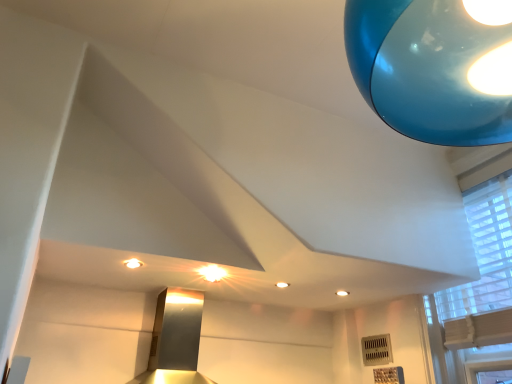
What do you see at coordinates (133, 263) in the screenshot?
I see `matte white light fixture at upper center` at bounding box center [133, 263].

You are a GUI agent. You are given a task and a screenshot of the screen. Output one action in this format:
    pyautogui.click(x=<x>, y=<y>)
    Task: Click on the matte white light fixture at upper center
    
    Given the screenshot: What is the action you would take?
    pyautogui.click(x=133, y=263)

I want to click on white textured window at upper right, so click(480, 290).

This screenshot has height=384, width=512. What do you see at coordinates (480, 290) in the screenshot?
I see `white textured window at upper right` at bounding box center [480, 290].

Identify the location of matte white light fixture at upper center. The width and height of the screenshot is (512, 384). (133, 263).

Between white textured window at upper right and matte white light fixture at upper center, which one appears on the right side from the viewer's perspective?

Positioned to the right is white textured window at upper right.

Considering their positions, is white textured window at upper right located in front of or behind matte white light fixture at upper center?

white textured window at upper right is positioned closer to the viewer than matte white light fixture at upper center.

Considering the positions of points (459, 304) and (126, 264), is point (459, 304) farther from camera compared to point (126, 264)?

Yes, point (459, 304) is behind point (126, 264).

From the image's perspective, which is below, white textured window at upper right or matte white light fixture at upper center?

white textured window at upper right, from the image's perspective.

From a real-world perspective, is white textured window at upper right below matte white light fixture at upper center?

No, from a real-world perspective, white textured window at upper right is not under matte white light fixture at upper center.

Considering the sizes of objects white textured window at upper right and matte white light fixture at upper center in the image provided, who is wider, white textured window at upper right or matte white light fixture at upper center?

white textured window at upper right is wider.

Consider the image. In terms of height, does white textured window at upper right look taller or shorter compared to matte white light fixture at upper center?

Clearly, white textured window at upper right is taller compared to matte white light fixture at upper center.

Who is smaller, white textured window at upper right or matte white light fixture at upper center?

matte white light fixture at upper center is smaller.

Is white textured window at upper right located outside matte white light fixture at upper center?

Yes, white textured window at upper right is located beyond the bounds of matte white light fixture at upper center.

Is white textured window at upper right not near matte white light fixture at upper center?

That's right, there is a large distance between white textured window at upper right and matte white light fixture at upper center.

Is white textured window at upper right oriented towards matte white light fixture at upper center?

Yes, white textured window at upper right faces towards matte white light fixture at upper center.

Can you tell me how much white textured window at upper right and matte white light fixture at upper center differ in facing direction?

There is a 89.1-degree angle between the facing directions of white textured window at upper right and matte white light fixture at upper center.

The width and height of the screenshot is (512, 384). I want to click on lighting located underneath the white textured window at upper right (from a real-world perspective), so click(133, 263).

Which object is positioned more to the left, matte white light fixture at upper center or white textured window at upper right?

From the viewer's perspective, matte white light fixture at upper center appears more on the left side.

Is matte white light fixture at upper center in front of or behind white textured window at upper right in the image?

matte white light fixture at upper center is positioned farther from the viewer than white textured window at upper right.

Considering the positions of points (138, 265) and (478, 241), is point (138, 265) farther from camera compared to point (478, 241)?

No, (138, 265) is in front of (478, 241).

From the image's perspective, is matte white light fixture at upper center located above or below white textured window at upper right?

matte white light fixture at upper center is above white textured window at upper right.

From a real-world perspective, is matte white light fixture at upper center physically below white textured window at upper right?

Indeed, from a real-world perspective, matte white light fixture at upper center is positioned beneath white textured window at upper right.

Consider the image. Looking at their sizes, would you say matte white light fixture at upper center is wider or thinner than white textured window at upper right?

Considering their sizes, matte white light fixture at upper center looks slimmer than white textured window at upper right.

Can you confirm if matte white light fixture at upper center is shorter than white textured window at upper right?

Yes.

Considering the sizes of objects matte white light fixture at upper center and white textured window at upper right in the image provided, who is smaller, matte white light fixture at upper center or white textured window at upper right?

With smaller size is matte white light fixture at upper center.

Would you say matte white light fixture at upper center is inside or outside white textured window at upper right?

matte white light fixture at upper center lies outside white textured window at upper right.

In the scene shown: Are matte white light fixture at upper center and white textured window at upper right far apart?

Absolutely, matte white light fixture at upper center is distant from white textured window at upper right.

In the scene shown: Is matte white light fixture at upper center oriented away from white textured window at upper right?

No, matte white light fixture at upper center's orientation is not away from white textured window at upper right.

What's the angular difference between matte white light fixture at upper center and white textured window at upper right's facing directions?

The angular difference between matte white light fixture at upper center and white textured window at upper right is 89.1 degrees.

Where is `window positioned vertically above the matte white light fixture at upper center (from a real-world perspective)`? window positioned vertically above the matte white light fixture at upper center (from a real-world perspective) is located at coordinates (480, 290).

Locate an element on the screen. The width and height of the screenshot is (512, 384). lighting below the white textured window at upper right (from a real-world perspective) is located at coordinates point(133,263).

Identify the location of lighting on the left side of white textured window at upper right. The image size is (512, 384). (133, 263).